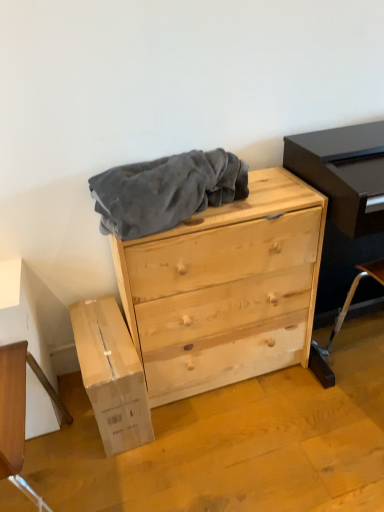
Question: Would you say natural wood chest of drawers at center is part of matte black entertainment center at right's contents?

Choices:
 (A) no
 (B) yes

Answer: (A)

Question: Does matte black entertainment center at right turn towards natural wood chest of drawers at center?

Choices:
 (A) no
 (B) yes

Answer: (A)

Question: Are matte black entertainment center at right and natural wood chest of drawers at center making contact?

Choices:
 (A) no
 (B) yes

Answer: (A)

Question: Considering the relative sizes of matte black entertainment center at right and natural wood chest of drawers at center in the image provided, is matte black entertainment center at right taller than natural wood chest of drawers at center?

Choices:
 (A) yes
 (B) no

Answer: (A)

Question: Can you confirm if matte black entertainment center at right is shorter than natural wood chest of drawers at center?

Choices:
 (A) yes
 (B) no

Answer: (B)

Question: From a real-world perspective, is matte black entertainment center at right physically below natural wood chest of drawers at center?

Choices:
 (A) yes
 (B) no

Answer: (B)

Question: Is natural wood chest of drawers at center wider than matte black entertainment center at right?

Choices:
 (A) no
 (B) yes

Answer: (B)

Question: Is natural wood chest of drawers at center closer to camera compared to matte black entertainment center at right?

Choices:
 (A) yes
 (B) no

Answer: (B)

Question: From a real-world perspective, is natural wood chest of drawers at center located beneath matte black entertainment center at right?

Choices:
 (A) no
 (B) yes

Answer: (B)

Question: Is natural wood chest of drawers at center to the right of matte black entertainment center at right from the viewer's perspective?

Choices:
 (A) no
 (B) yes

Answer: (A)

Question: Is matte black entertainment center at right at the back of natural wood chest of drawers at center?

Choices:
 (A) no
 (B) yes

Answer: (A)

Question: Does natural wood chest of drawers at center have a smaller size compared to matte black entertainment center at right?

Choices:
 (A) yes
 (B) no

Answer: (B)

Question: Is natural wood chest of drawers at center surrounding velvety gray blanket at center?

Choices:
 (A) no
 (B) yes

Answer: (A)